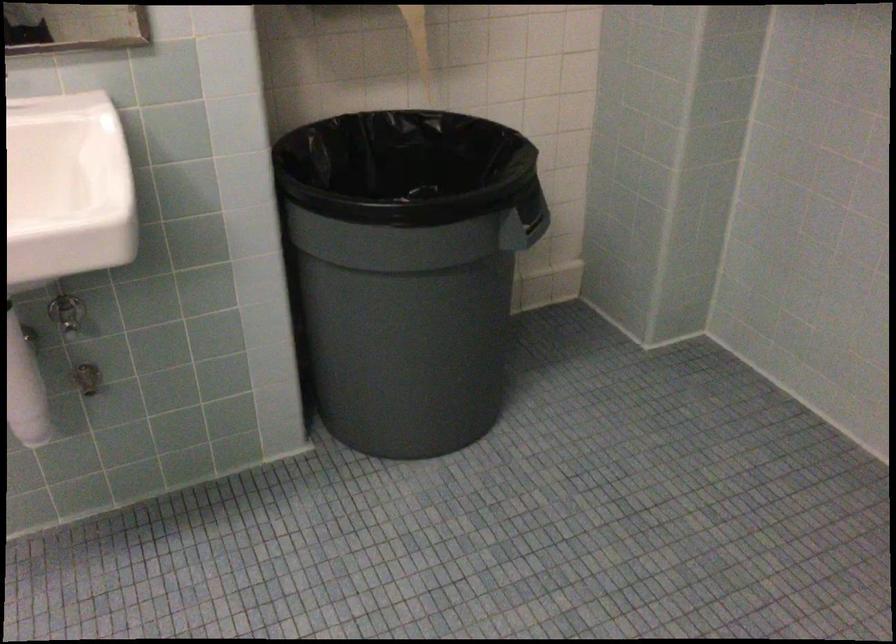
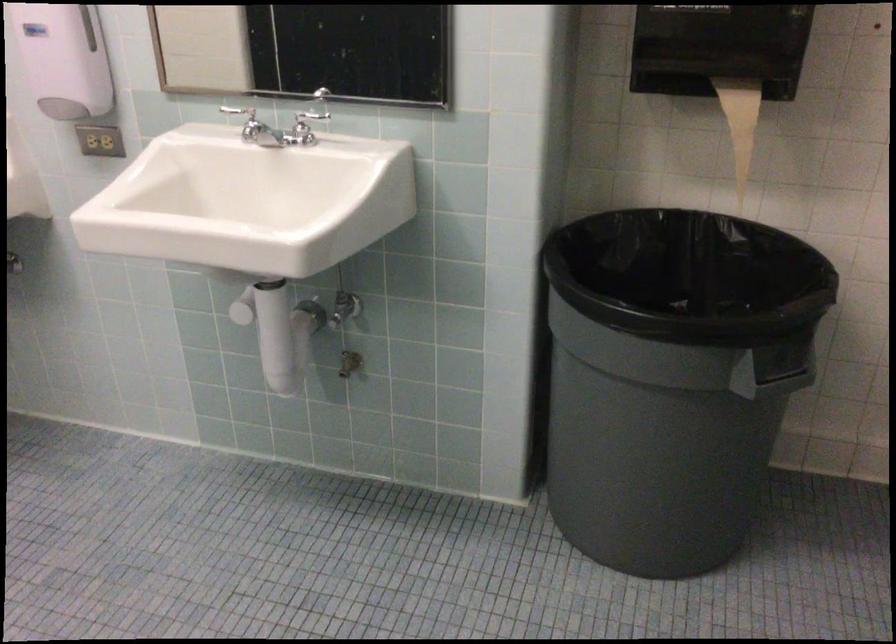
Question: How did the camera likely rotate?

Choices:
 (A) Left
 (B) Right
 (C) Up
 (D) Down

Answer: (A)